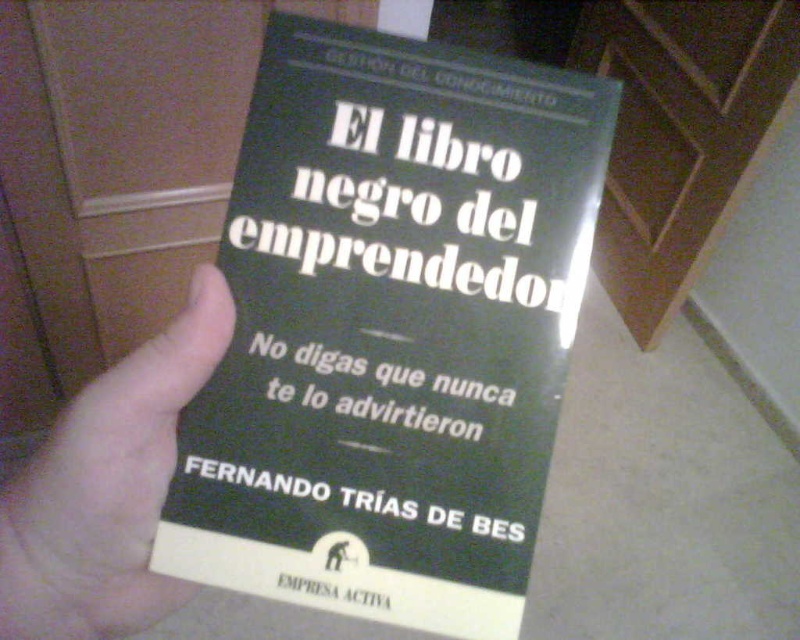
You are a photographer who needs to take a clear photo of the matte black book at center. The camera you are using has a minimum focusing distance of 15 inches. Can you take the photo without moving the book or the camera?

The matte black book at center and camera are 14.76 inches apart from each other. Since the minimum focusing distance is 15 inches, the camera cannot focus properly at 14.76 inches. Therefore, you cannot take a clear photo without moving the book or the camera.

You are an artist trying to sketch the scene. You need to decide the order of drawing elements based on their positions. Which object should you draw first, the matte black book at center or the skinny white hand at center?

The matte black book at center should be drawn first because it is located above the skinny white hand at center, meaning it is positioned higher in the visual hierarchy and likely closer to the viewer.

You are standing in front of the book cover and want to touch both points mentioned. Which point should you reach for first, the point at coordinates point (482, 637) or point (20, 515)?

You should reach for point (482, 637) first because it is closer to you than point (20, 515), which is further away.